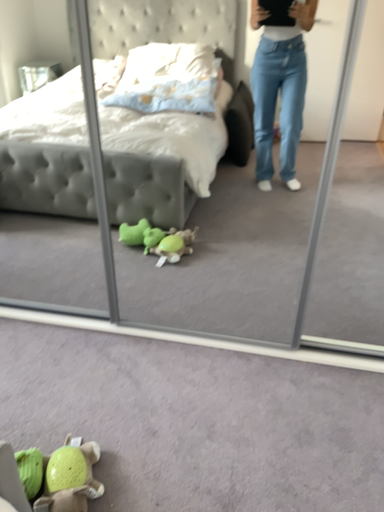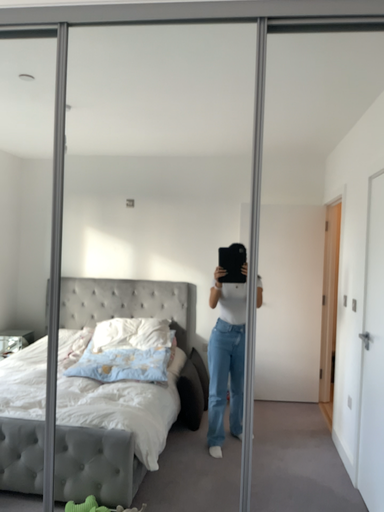
Question: Which way did the camera rotate in the video?

Choices:
 (A) rotated downward
 (B) rotated upward

Answer: (B)